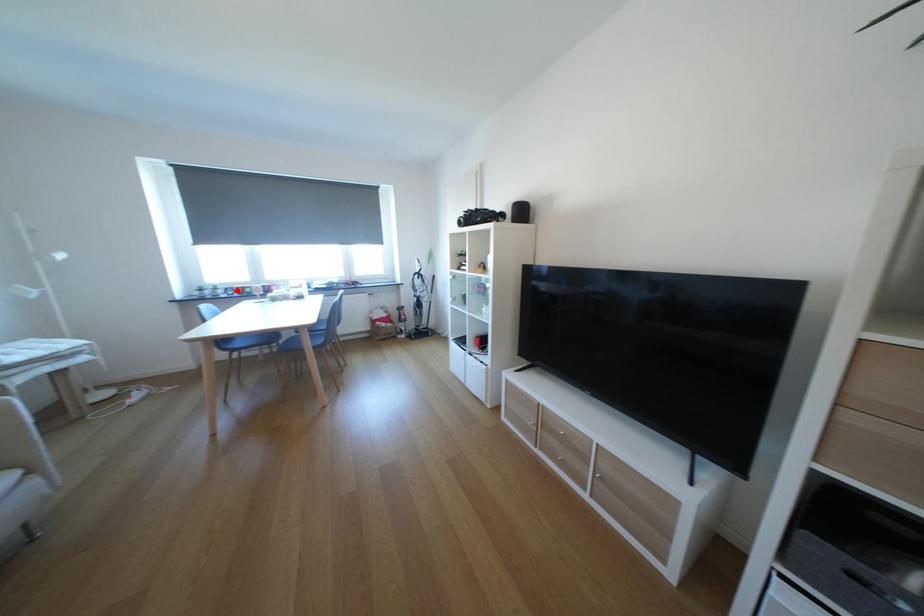
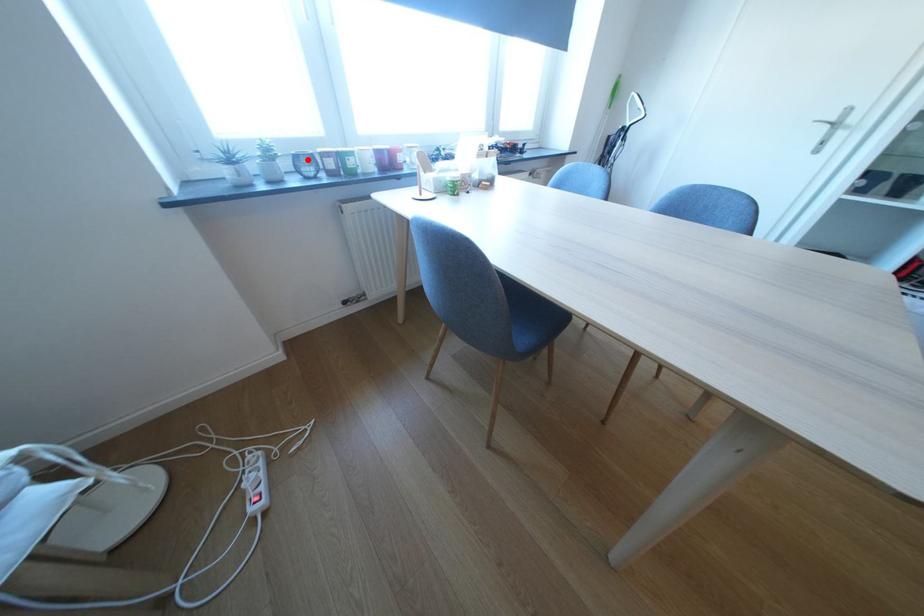
I am providing you with two images of the same scene from different viewpoints. A red point is marked on the first image and another point is marked on the second image. Is the red point in image1 aligned with the point shown in image2?

Yes